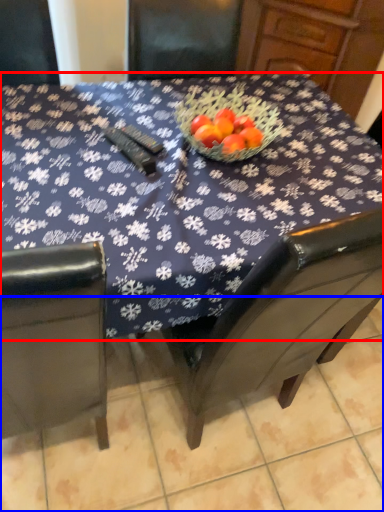
Question: Which point is closer to the camera, table (highlighted by a red box) or tile (highlighted by a blue box)?

Choices:
 (A) table
 (B) tile

Answer: (A)